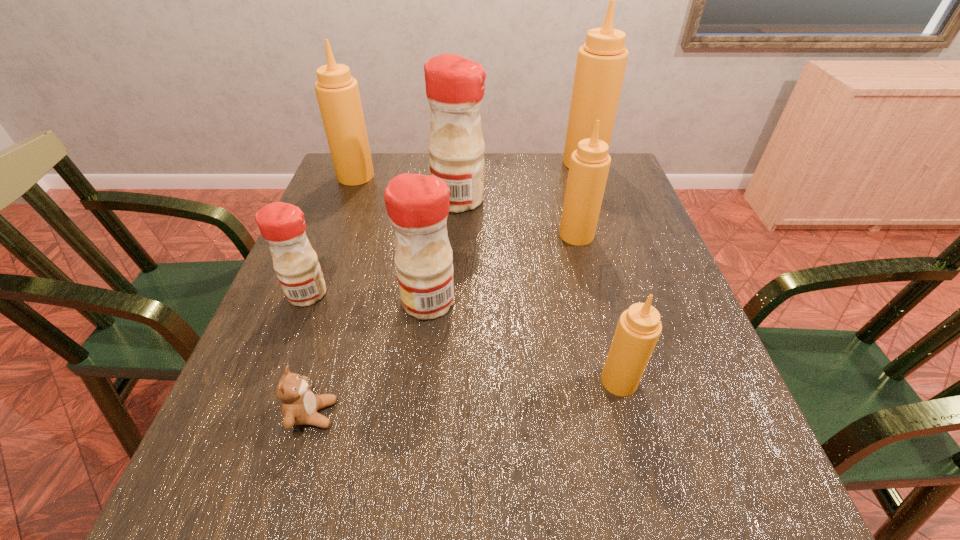
Where is `object at the far left corner`? The image size is (960, 540). object at the far left corner is located at coordinates (337, 92).

Where is `object positioned at the far right corner`? object positioned at the far right corner is located at coordinates (601, 62).

Locate an element on the screen. The height and width of the screenshot is (540, 960). vacant space at the far edge of the desktop is located at coordinates (498, 175).

The image size is (960, 540). In order to click on free space at the near edge of the desktop in this screenshot , I will do point(497,486).

In the image, there is a desktop. At what (x,y) coordinates should I click in order to perform the action: click on vacant region at the left edge. Please return your answer as a coordinate pair (x, y). This screenshot has height=540, width=960. Looking at the image, I should click on (330, 359).

You are a GUI agent. You are given a task and a screenshot of the screen. Output one action in this format:
    pyautogui.click(x=<x>, y=<y>)
    Task: Click on the vacant space at the right edge
    This screenshot has height=540, width=960.
    Given the screenshot: What is the action you would take?
    pyautogui.click(x=602, y=207)

Where is `blank space at the near left corner of the desktop`? blank space at the near left corner of the desktop is located at coordinates 177,519.

Image resolution: width=960 pixels, height=540 pixels. Identify the location of free spot between the second nearest tan condiment and the smallest tan condiment. (598, 308).

Where is `vacant space in between the farthest red condiment and the nearest tan condiment`? vacant space in between the farthest red condiment and the nearest tan condiment is located at coordinates (539, 291).

The height and width of the screenshot is (540, 960). What are the coordinates of `free space between the shortest object and the leftmost tan condiment` in the screenshot? It's located at (334, 295).